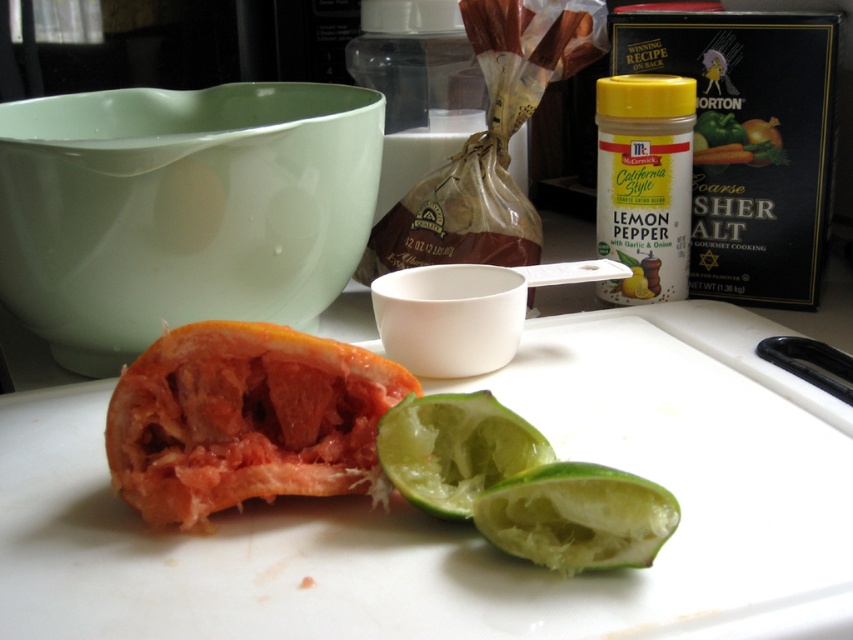
Question: From the image, what is the correct spatial relationship of orange flesh at center in relation to yellow plastic container at upper right?

Choices:
 (A) below
 (B) above

Answer: (A)

Question: Does orange flesh at center have a larger size compared to green matte lime at lower center?

Choices:
 (A) no
 (B) yes

Answer: (B)

Question: Which point is farther to the camera?

Choices:
 (A) green matte lime at lower center
 (B) yellow plastic container at upper right
 (C) green matte pepper at upper right

Answer: (C)

Question: Which of the following is the farthest from the observer?

Choices:
 (A) (601, 100)
 (B) (734, 141)
 (C) (485, 509)

Answer: (B)

Question: Which point is farther from the camera taking this photo?

Choices:
 (A) (699, 132)
 (B) (442, 394)
 (C) (387, 362)
 (D) (671, 193)

Answer: (A)

Question: Is orange flesh at center wider than green matte lime at lower center?

Choices:
 (A) no
 (B) yes

Answer: (B)